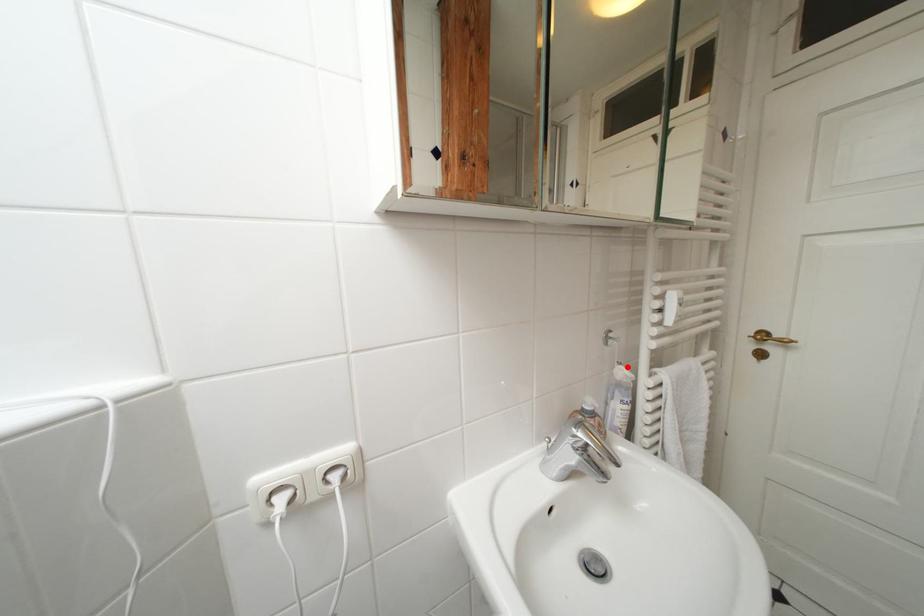
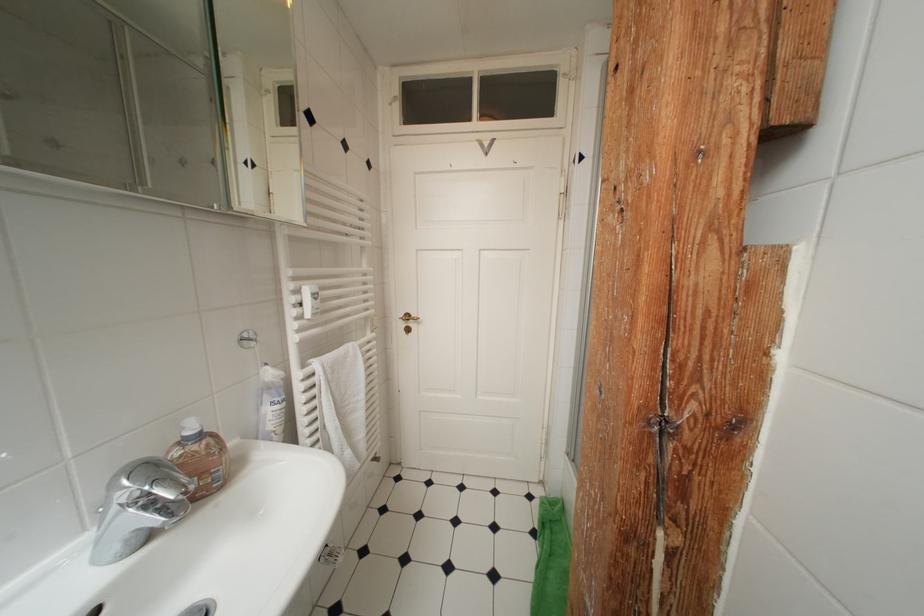
Locate, in the second image, the point that corresponds to the highlighted location in the first image.

(274, 368)